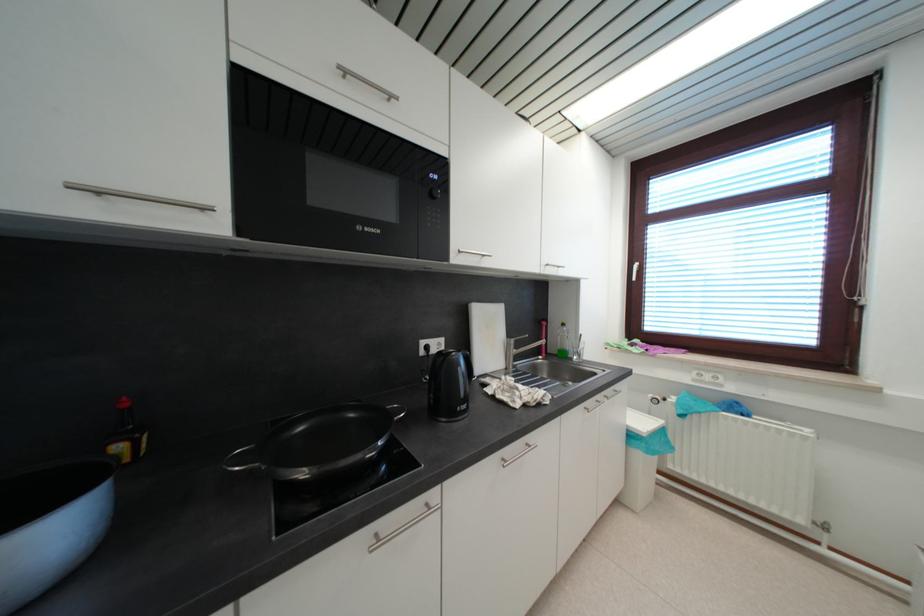
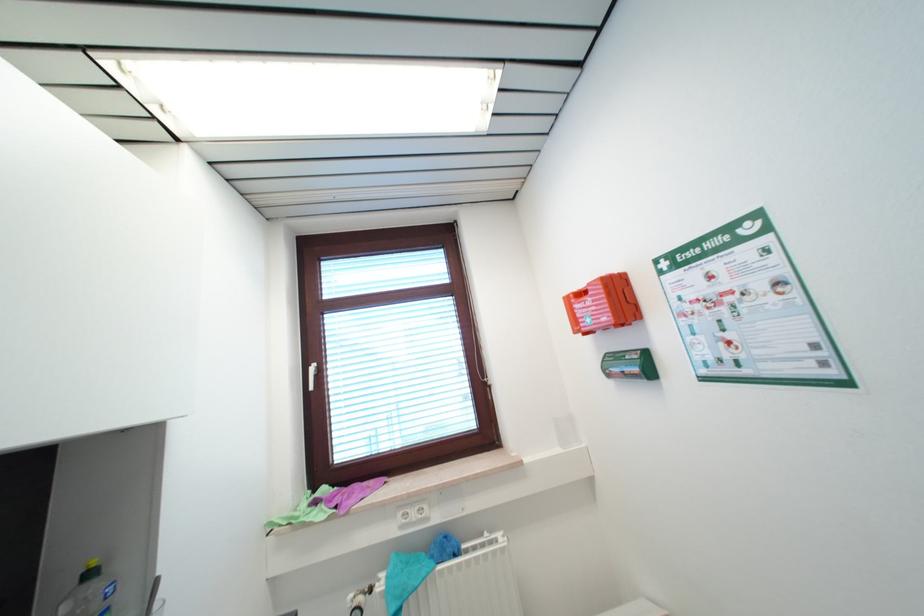
Locate, in the second image, the point that corresponds to point 613,346 in the first image.

(274, 525)